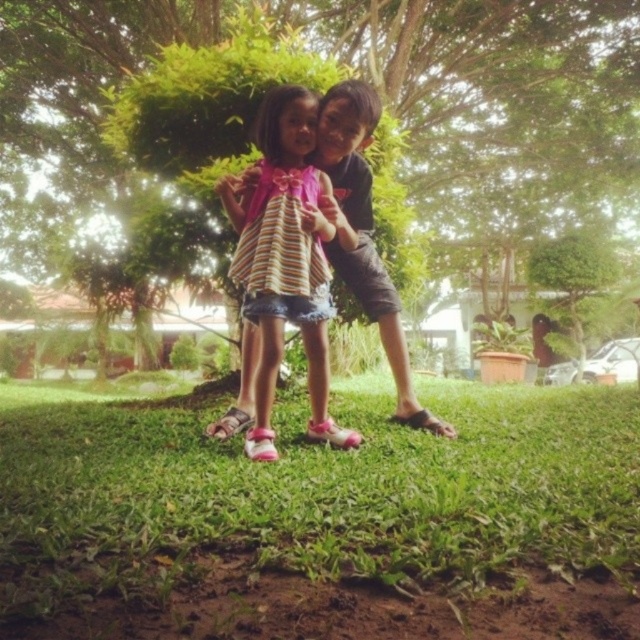
Question: Can you confirm if green grass at lower center is bigger than green leafy tree at center?

Choices:
 (A) yes
 (B) no

Answer: (B)

Question: Is green grass at lower center above green leafy tree at center?

Choices:
 (A) yes
 (B) no

Answer: (B)

Question: Does green grass at lower center have a larger size compared to striped fabric dress at center?

Choices:
 (A) no
 (B) yes

Answer: (A)

Question: Which of these objects is positioned farthest from the striped fabric dress at center?

Choices:
 (A) green grass at lower center
 (B) green leafy tree at center

Answer: (B)

Question: Which object is farther from the camera taking this photo?

Choices:
 (A) striped fabric dress at center
 (B) green grass at lower center
 (C) green leafy tree at center

Answer: (B)

Question: Which point is closer to the camera taking this photo?

Choices:
 (A) (307, 216)
 (B) (541, 136)

Answer: (A)